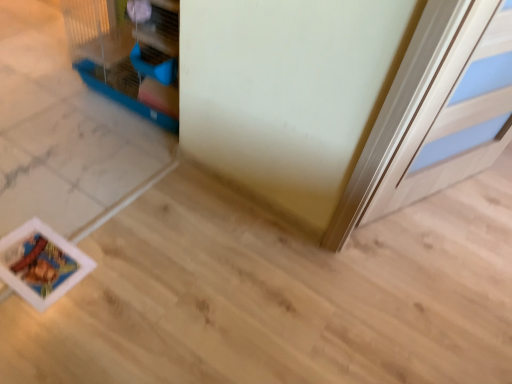
Question: Is blue plastic bird cage at upper left positioned beyond the bounds of white glossy door at upper right?

Choices:
 (A) no
 (B) yes

Answer: (B)

Question: Is blue plastic bird cage at upper left placed right next to white glossy door at upper right?

Choices:
 (A) no
 (B) yes

Answer: (A)

Question: Considering the relative sizes of blue plastic bird cage at upper left and white glossy door at upper right in the image provided, is blue plastic bird cage at upper left smaller than white glossy door at upper right?

Choices:
 (A) yes
 (B) no

Answer: (B)

Question: Does blue plastic bird cage at upper left have a greater width compared to white glossy door at upper right?

Choices:
 (A) no
 (B) yes

Answer: (B)

Question: From a real-world perspective, does blue plastic bird cage at upper left stand above white glossy door at upper right?

Choices:
 (A) yes
 (B) no

Answer: (B)

Question: Is blue plastic bird cage at upper left not near white glossy door at upper right?

Choices:
 (A) yes
 (B) no

Answer: (A)

Question: Is white glossy door at upper right placed right next to blue plastic bird cage at upper left?

Choices:
 (A) yes
 (B) no

Answer: (B)

Question: Is white glossy door at upper right positioned behind blue plastic bird cage at upper left?

Choices:
 (A) yes
 (B) no

Answer: (B)

Question: Can you confirm if white glossy door at upper right is wider than blue plastic bird cage at upper left?

Choices:
 (A) yes
 (B) no

Answer: (B)

Question: Does white glossy door at upper right lie in front of blue plastic bird cage at upper left?

Choices:
 (A) no
 (B) yes

Answer: (B)

Question: Is blue plastic bird cage at upper left at the back of white glossy door at upper right?

Choices:
 (A) no
 (B) yes

Answer: (B)

Question: From a real-world perspective, is white glossy door at upper right physically above blue plastic bird cage at upper left?

Choices:
 (A) no
 (B) yes

Answer: (B)

Question: Would you say white glossy door at upper right is to the left or to the right of blue plastic bird cage at upper left in the picture?

Choices:
 (A) right
 (B) left

Answer: (A)